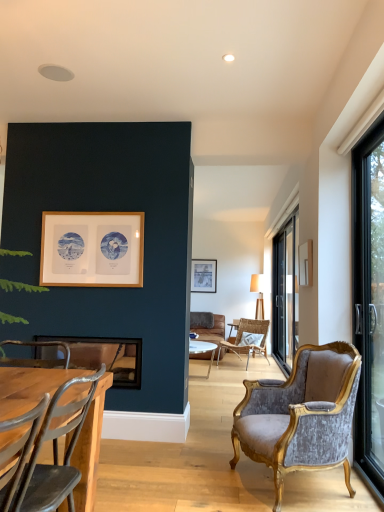
Question: Considering the relative positions of metallic silver picture frame at lower left, marked as the third picture frame in a top-to-bottom arrangement, and velvet/gold armchair at right, placed as the 2th chair when sorted from front to back, in the image provided, is metallic silver picture frame at lower left, marked as the third picture frame in a top-to-bottom arrangement, to the left of velvet/gold armchair at right, placed as the 2th chair when sorted from front to back, from the viewer's perspective?

Choices:
 (A) yes
 (B) no

Answer: (A)

Question: Is metallic silver picture frame at lower left, which is the first picture frame from front to back, not within velvet/gold armchair at right, marked as the second chair in a right-to-left arrangement?

Choices:
 (A) yes
 (B) no

Answer: (A)

Question: Are metallic silver picture frame at lower left, marked as the third picture frame in a top-to-bottom arrangement, and velvet/gold armchair at right, marked as the second chair in a right-to-left arrangement, beside each other?

Choices:
 (A) no
 (B) yes

Answer: (A)

Question: Is metallic silver picture frame at lower left, marked as the third picture frame in a top-to-bottom arrangement, far from velvet/gold armchair at right, which is the 2th chair from left to right?

Choices:
 (A) no
 (B) yes

Answer: (B)

Question: Is metallic silver picture frame at lower left, positioned as the third picture frame in back-to-front order, wider than velvet/gold armchair at right, marked as the second chair in a right-to-left arrangement?

Choices:
 (A) yes
 (B) no

Answer: (B)

Question: Considering the relative positions of metallic silver picture frame at lower left, which is the first picture frame from front to back, and velvet/gold armchair at right, placed as the 2th chair when sorted from front to back, in the image provided, is metallic silver picture frame at lower left, which is the first picture frame from front to back, behind velvet/gold armchair at right, placed as the 2th chair when sorted from front to back,?

Choices:
 (A) no
 (B) yes

Answer: (B)

Question: Is metallic gray chair at lower left, the 1th chair viewed from the left, wider than woven rattan chair at center, placed as the third chair when sorted from front to back?

Choices:
 (A) yes
 (B) no

Answer: (B)

Question: Can you confirm if metallic gray chair at lower left, which is counted as the 1th chair, starting from the front, is bigger than woven rattan chair at center, placed as the third chair when sorted from front to back?

Choices:
 (A) yes
 (B) no

Answer: (B)

Question: From the image's perspective, is metallic gray chair at lower left, the 1th chair viewed from the left, on top of woven rattan chair at center, which is counted as the 1th chair, starting from the right?

Choices:
 (A) yes
 (B) no

Answer: (A)

Question: From a real-world perspective, is metallic gray chair at lower left, which is the third chair in back-to-front order, under woven rattan chair at center, the first chair positioned from the back?

Choices:
 (A) no
 (B) yes

Answer: (A)

Question: Can you confirm if metallic gray chair at lower left, the 1th chair viewed from the left, is thinner than woven rattan chair at center, the 3th chair in the left-to-right sequence?

Choices:
 (A) yes
 (B) no

Answer: (A)

Question: Considering the relative sizes of metallic gray chair at lower left, which is the third chair in back-to-front order, and woven rattan chair at center, the first chair positioned from the back, in the image provided, is metallic gray chair at lower left, which is the third chair in back-to-front order, shorter than woven rattan chair at center, the first chair positioned from the back,?

Choices:
 (A) no
 (B) yes

Answer: (B)

Question: Is black glass screen door at right outside matte wooden picture frame at center, the 3th picture frame positioned from the front?

Choices:
 (A) no
 (B) yes

Answer: (B)